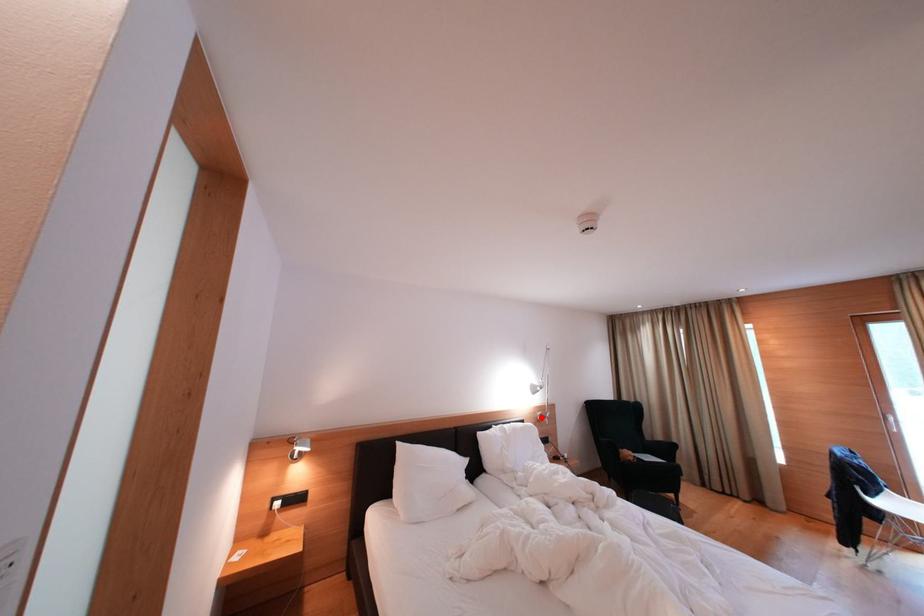
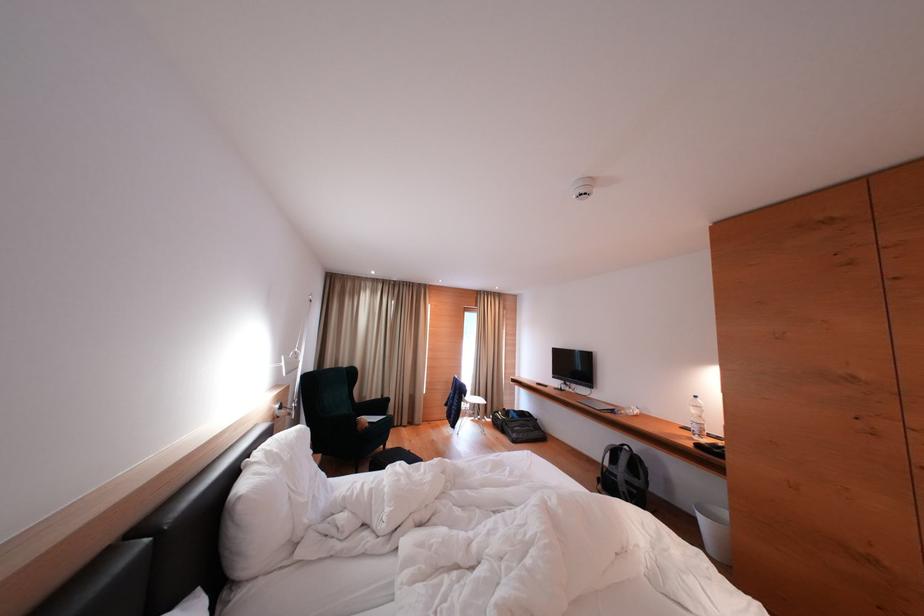
Where in the second image is the point corresponding to the highlighted location from the first image?

(277, 411)